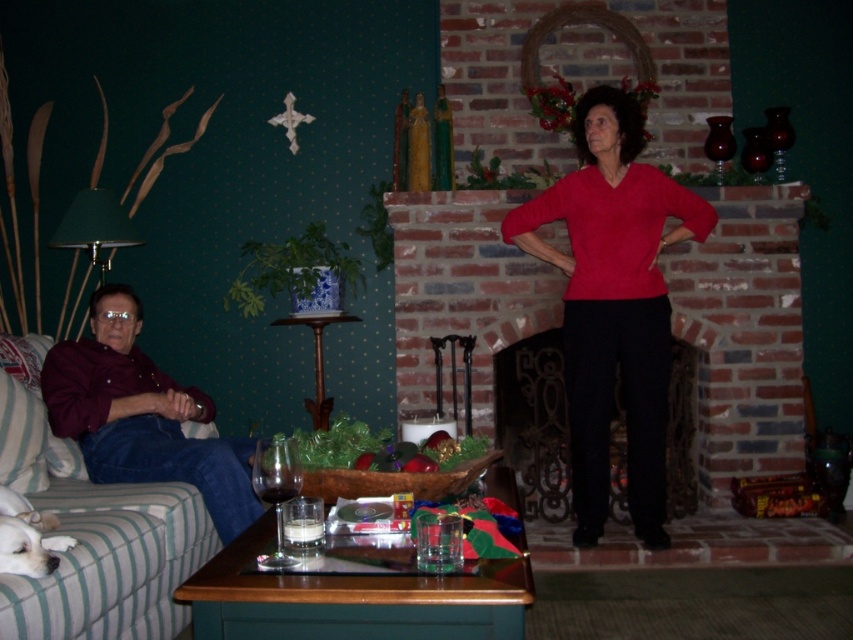
You are standing at the brick fireplace at center and want to toss a ball to the man sitting on the striped couch. Can you reach him without the ball going over any obstacles?

The distance between the brick fireplace at center and the man on the striped couch is 3.59 meters. Assuming the ball can travel that distance, there are no mentioned obstacles in the scene description, so yes, you can reach him.